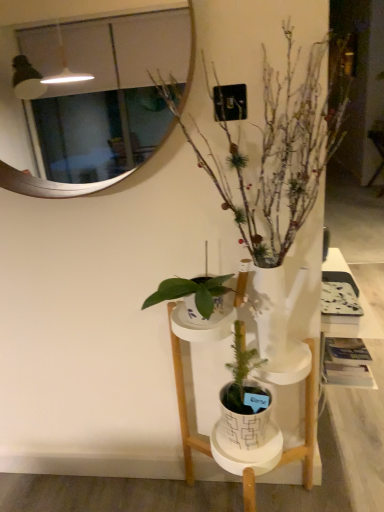
Question: Considering the relative positions of white glossy mirror at upper center and white matte vase at center in the image provided, is white glossy mirror at upper center to the left or to the right of white matte vase at center?

Choices:
 (A) right
 (B) left

Answer: (B)

Question: Looking at their shapes, would you say white glossy mirror at upper center is wider or thinner than white matte vase at center?

Choices:
 (A) thin
 (B) wide

Answer: (A)

Question: Considering the real-world distances, which object is closest to the white ceramic pot at center?

Choices:
 (A) white glossy mirror at upper center
 (B) white matte vase at center

Answer: (B)

Question: Estimate the real-world distances between objects in this image. Which object is farther from the white matte vase at center?

Choices:
 (A) white ceramic pot at center
 (B) white glossy mirror at upper center

Answer: (A)